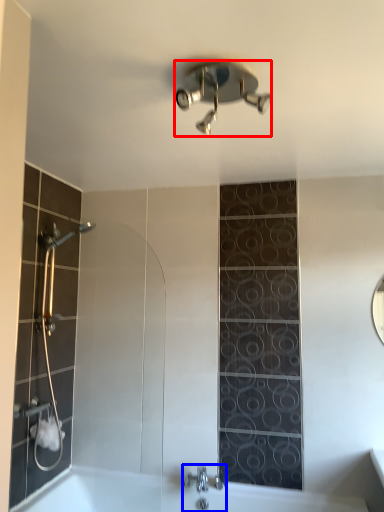
Question: Which object appears farthest to the camera in this image, shower (highlighted by a red box) or tap (highlighted by a blue box)?

Choices:
 (A) shower
 (B) tap

Answer: (B)